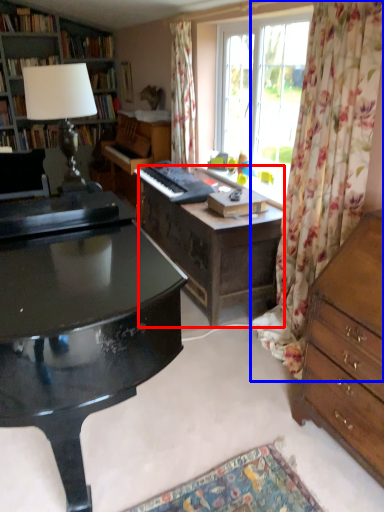
Question: Which of the following is the farthest to the observer, vanity (highlighted by a red box) or curtain (highlighted by a blue box)?

Choices:
 (A) vanity
 (B) curtain

Answer: (A)